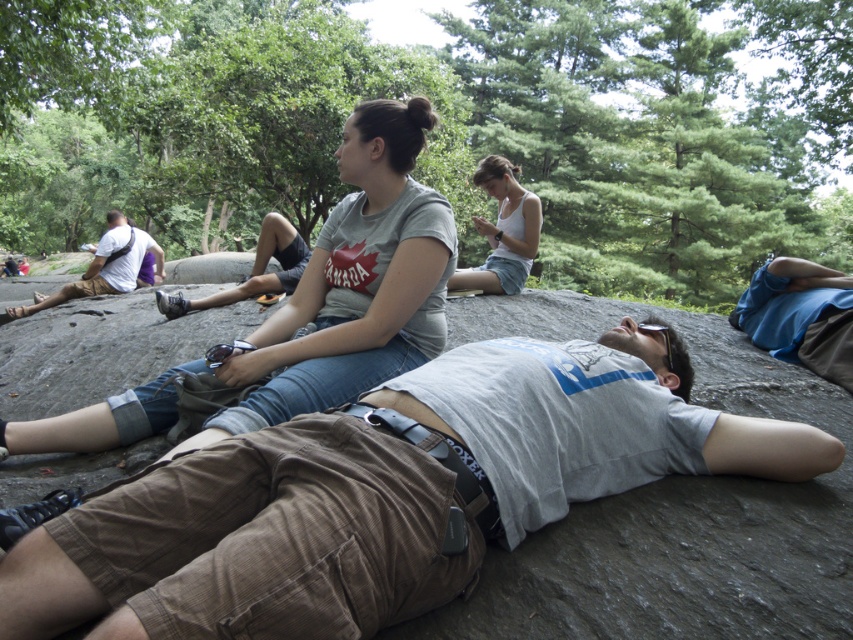
Question: Does gray cotton t-shirt at upper center have a lesser width compared to white cotton tank top at center?

Choices:
 (A) yes
 (B) no

Answer: (A)

Question: Is light brown corduroy shorts at center smaller than clear plastic goggles at center?

Choices:
 (A) yes
 (B) no

Answer: (B)

Question: Which of the following is the closest to the observer?

Choices:
 (A) (355, 474)
 (B) (508, 264)

Answer: (A)

Question: Is light brown corduroy shorts at center bigger than gray cotton t-shirt at upper center?

Choices:
 (A) yes
 (B) no

Answer: (A)

Question: Which object is positioned farthest from the light brown corduroy shorts at center?

Choices:
 (A) clear plastic goggles at center
 (B) white cotton tank top at center

Answer: (B)

Question: Which object is farther from the camera taking this photo?

Choices:
 (A) gray cotton t-shirt at upper center
 (B) brown leather backpack at left
 (C) light brown corduroy shorts at center

Answer: (B)